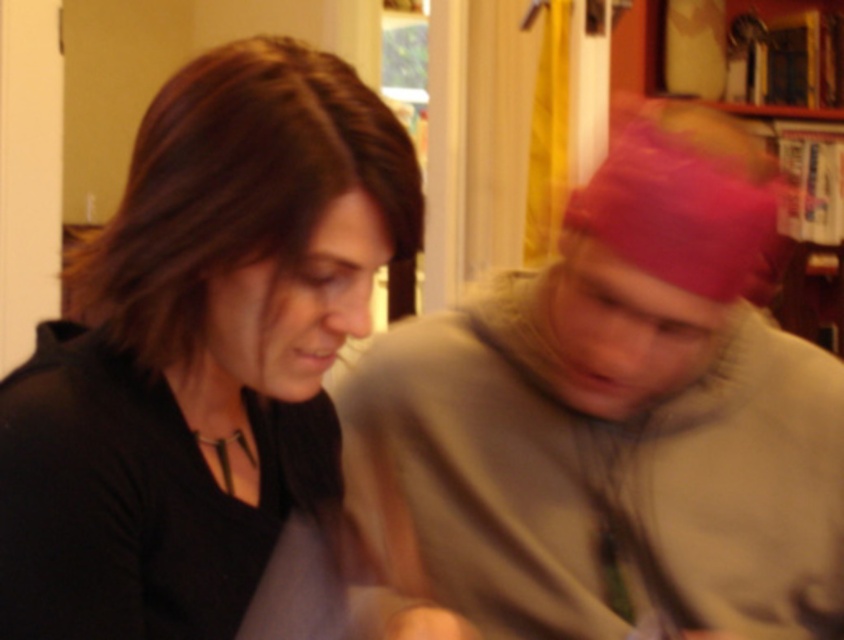
Who is lower down, black matte shirt at left or wooden bookshelf at upper right?

black matte shirt at left is lower down.

The width and height of the screenshot is (844, 640). What do you see at coordinates (201, 349) in the screenshot?
I see `black matte shirt at left` at bounding box center [201, 349].

The height and width of the screenshot is (640, 844). What are the coordinates of `black matte shirt at left` in the screenshot? It's located at (201, 349).

Which is more to the left, gray fleece sweater at center or wooden bookshelf at upper right?

Positioned to the left is gray fleece sweater at center.

Is gray fleece sweater at center positioned at the back of wooden bookshelf at upper right?

No, it is in front of wooden bookshelf at upper right.

Image resolution: width=844 pixels, height=640 pixels. Find the location of `gray fleece sweater at center`. gray fleece sweater at center is located at coordinates (610, 426).

Who is positioned more to the right, gray fleece sweater at center or black matte shirt at left?

gray fleece sweater at center is more to the right.

Is gray fleece sweater at center thinner than black matte shirt at left?

No, gray fleece sweater at center is not thinner than black matte shirt at left.

Locate an element on the screen. This screenshot has height=640, width=844. gray fleece sweater at center is located at coordinates (610, 426).

Image resolution: width=844 pixels, height=640 pixels. In order to click on gray fleece sweater at center in this screenshot , I will do `click(610, 426)`.